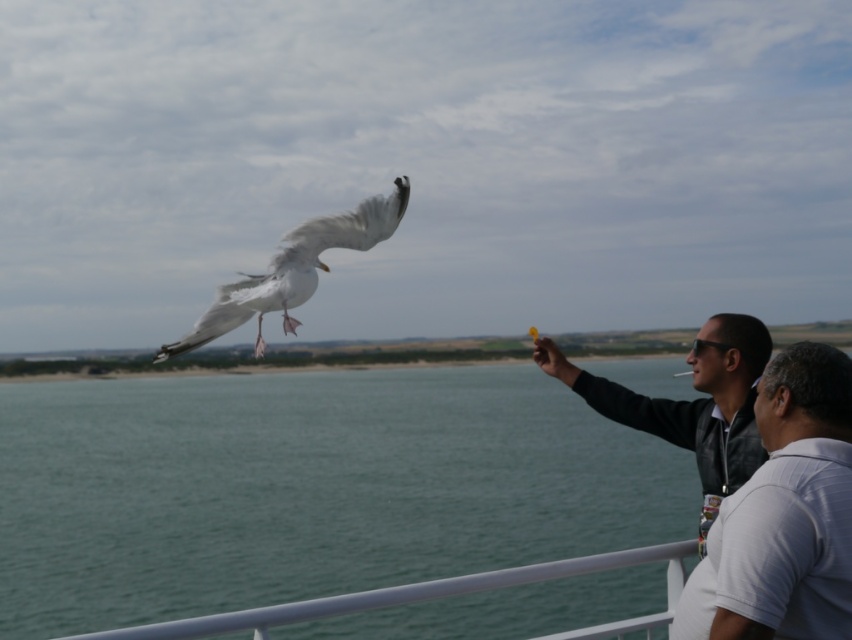
You are a photographer trying to capture the white feathered bird at upper left and the black leather jacket at right in the same frame. Based on their positions, which object will appear larger in your photo?

The black leather jacket at right appears larger in the photo because it is closer to the viewer than the white feathered bird at upper left.

You are a photographer trying to capture the seagull in flight. You notice the green water at lower left and the white striped polo shirt at right in your viewfinder. Which object is positioned higher in the frame?

The green water at lower left is taller than the white striped polo shirt at right, so the green water at lower left is positioned higher in the frame.